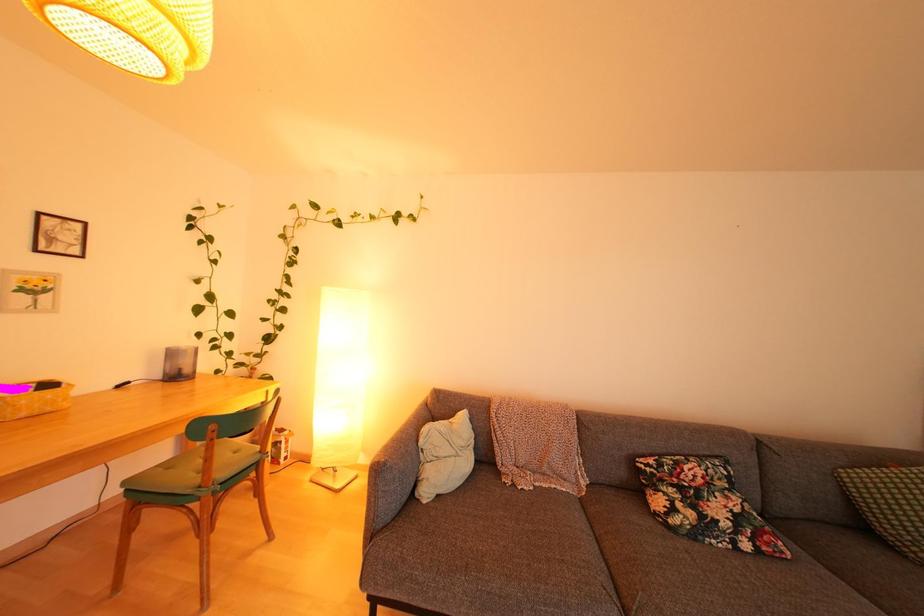
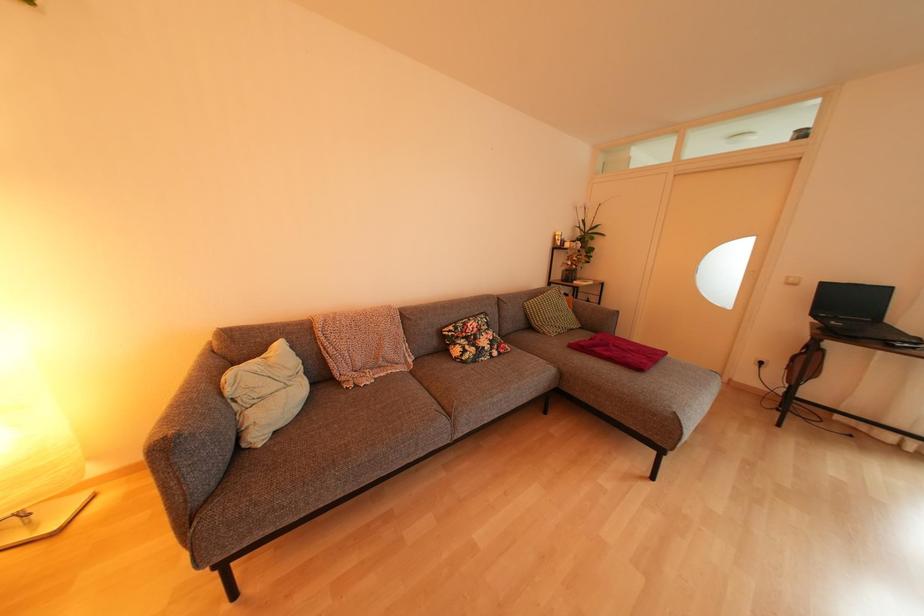
The first image is from the beginning of the video and the second image is from the end. How did the camera likely rotate when shooting the video?

The rotation direction of the camera is right-down.